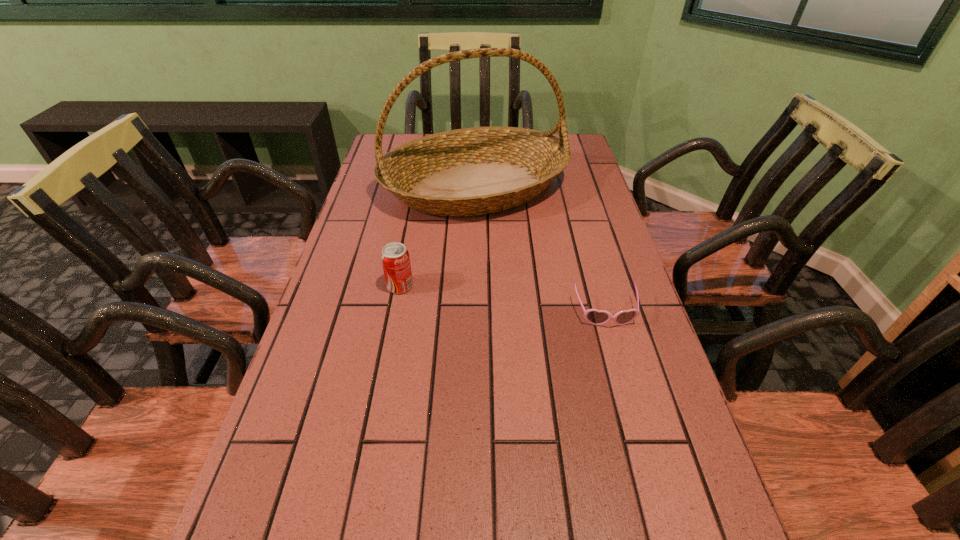
Locate an element on the screen. The image size is (960, 540). basket is located at coordinates (474, 171).

I want to click on the farthest object, so click(474, 171).

At what (x,y) coordinates should I click in order to perform the action: click on the second farthest object. Please return your answer as a coordinate pair (x, y). This screenshot has height=540, width=960. Looking at the image, I should click on (395, 258).

Locate an element on the screen. The width and height of the screenshot is (960, 540). the second tallest object is located at coordinates (395, 258).

In order to click on the shortest object in this screenshot , I will do `click(593, 316)`.

Where is `sunglasses`? sunglasses is located at coordinates (593, 316).

Where is `vacant space positioned on the front of the farthest object`? The width and height of the screenshot is (960, 540). vacant space positioned on the front of the farthest object is located at coordinates (474, 313).

Image resolution: width=960 pixels, height=540 pixels. I want to click on free space located on the front of the soda can, so [394, 318].

You are a GUI agent. You are given a task and a screenshot of the screen. Output one action in this format:
    pyautogui.click(x=<x>, y=<y>)
    Task: Click on the vacant space located 0.070m on the front-facing side of the sunglasses
    
    Given the screenshot: What is the action you would take?
    pyautogui.click(x=617, y=355)

The width and height of the screenshot is (960, 540). I want to click on object positioned at the far edge, so click(x=474, y=171).